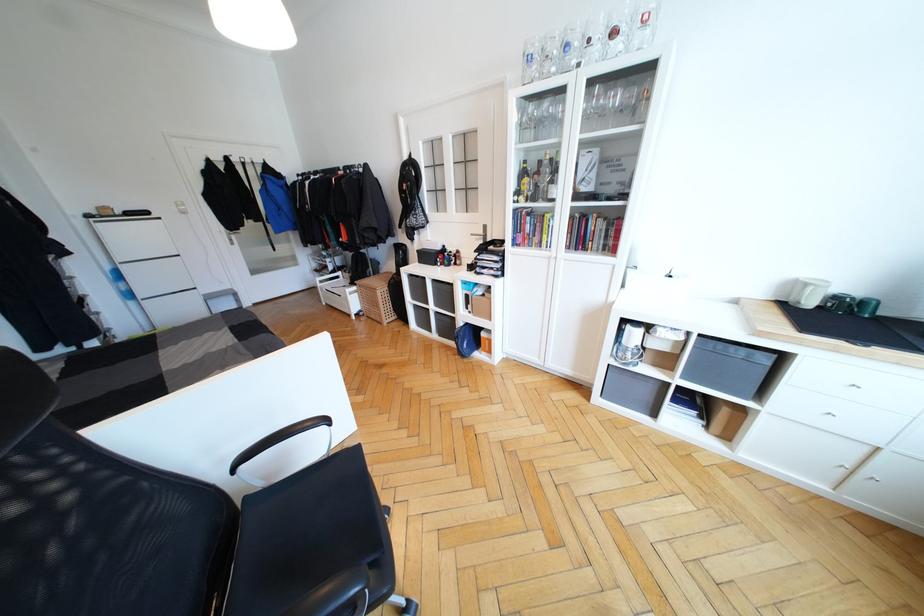
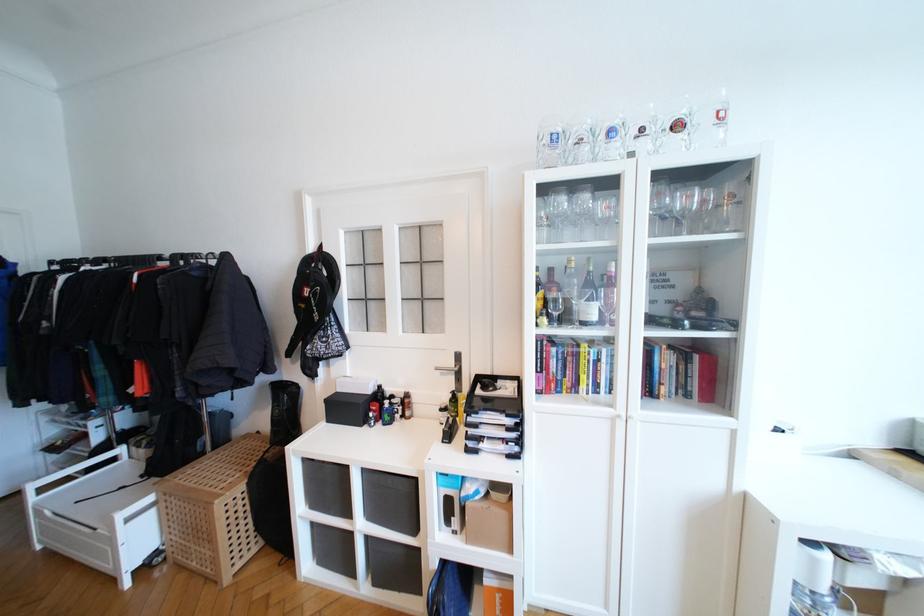
Locate, in the second image, the point that corresponds to pixel 484 233 in the first image.

(455, 363)